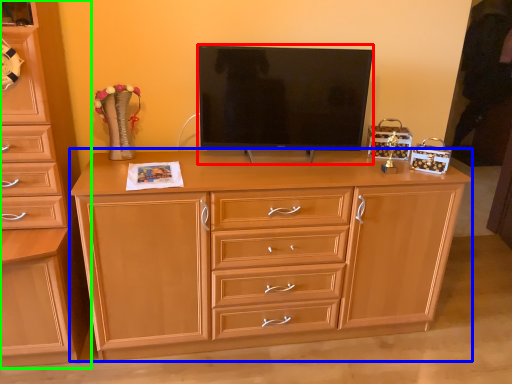
Question: Which is farther away from television (highlighted by a red box)? chest of drawers (highlighted by a blue box) or chest of drawers (highlighted by a green box)?

Choices:
 (A) chest of drawers
 (B) chest of drawers

Answer: (B)